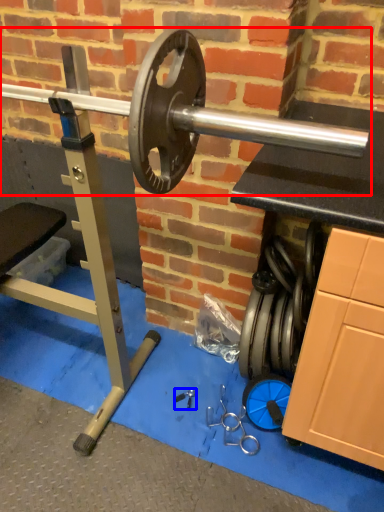
Question: Which point is further to the camera, barbell (highlighted by a red box) or tool (highlighted by a blue box)?

Choices:
 (A) barbell
 (B) tool

Answer: (B)